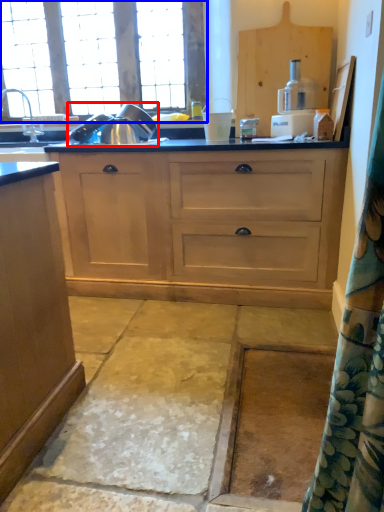
Question: Which point is closer to the camera, appliance (highlighted by a red box) or window (highlighted by a blue box)?

Choices:
 (A) appliance
 (B) window

Answer: (A)